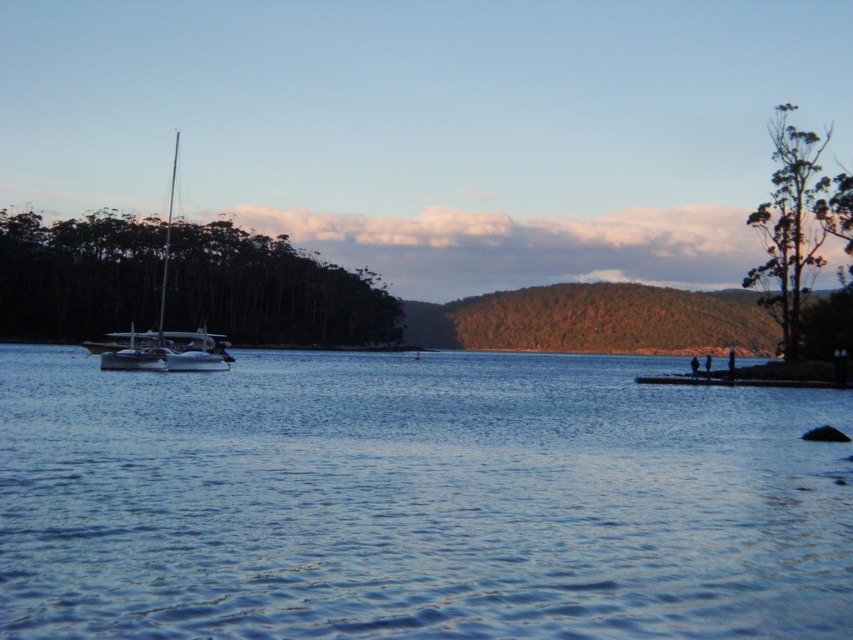
You are standing at the center of the image and want to walk towards the green matte tree at left. Which direction should you face to head directly towards it?

You should face towards the left direction to head directly towards the green matte tree at left since it is located at point (271, 291) which is on the left side of the image.

You are standing on the beach and see the blue water at center and the green matte tree at left. Which object is closer to your left side?

The green matte tree at left is closer to your left side because it is positioned on the left side of the blue water at center.

Looking at this image, you are standing on the beach and want to take a photo of both the green matte tree at left and the green leafy tree at upper right. Which tree should you position closer to the camera to ensure both are in the frame?

You should position the green leafy tree at upper right closer to the camera because it is taller than the green matte tree at left, so it will be more visible in the photo.